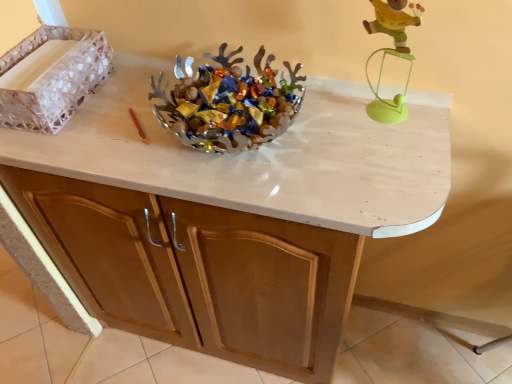
Question: From a real-world perspective, is metallic silver bowl at center on top of wooden figure at upper right?

Choices:
 (A) yes
 (B) no

Answer: (B)

Question: Does metallic silver bowl at center contain wooden figure at upper right?

Choices:
 (A) yes
 (B) no

Answer: (B)

Question: Is metallic silver bowl at center taller than wooden figure at upper right?

Choices:
 (A) no
 (B) yes

Answer: (A)

Question: Does metallic silver bowl at center have a lesser height compared to wooden figure at upper right?

Choices:
 (A) no
 (B) yes

Answer: (B)

Question: Does metallic silver bowl at center have a greater width compared to wooden figure at upper right?

Choices:
 (A) yes
 (B) no

Answer: (A)

Question: Is metallic silver bowl at center at the right side of wooden figure at upper right?

Choices:
 (A) no
 (B) yes

Answer: (A)

Question: Considering the relative sizes of metallic silver bowl at center and white textured tray at left in the image provided, is metallic silver bowl at center thinner than white textured tray at left?

Choices:
 (A) no
 (B) yes

Answer: (A)

Question: From a real-world perspective, is metallic silver bowl at center on top of white textured tray at left?

Choices:
 (A) yes
 (B) no

Answer: (B)

Question: From the image's perspective, is metallic silver bowl at center on white textured tray at left?

Choices:
 (A) yes
 (B) no

Answer: (B)

Question: Can you confirm if metallic silver bowl at center is wider than white textured tray at left?

Choices:
 (A) no
 (B) yes

Answer: (B)

Question: Would you say metallic silver bowl at center is a long distance from white textured tray at left?

Choices:
 (A) yes
 (B) no

Answer: (B)

Question: Is metallic silver bowl at center behind white textured tray at left?

Choices:
 (A) yes
 (B) no

Answer: (B)

Question: From the image's perspective, is wooden figure at upper right beneath matte wood cabinet at center?

Choices:
 (A) yes
 (B) no

Answer: (B)